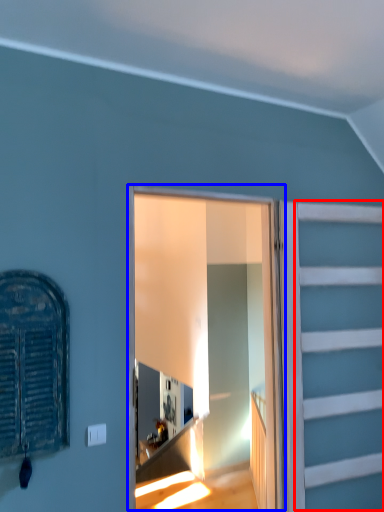
Question: Which point is closer to the camera, garage door (highlighted by a red box) or window frame (highlighted by a blue box)?

Choices:
 (A) garage door
 (B) window frame

Answer: (B)